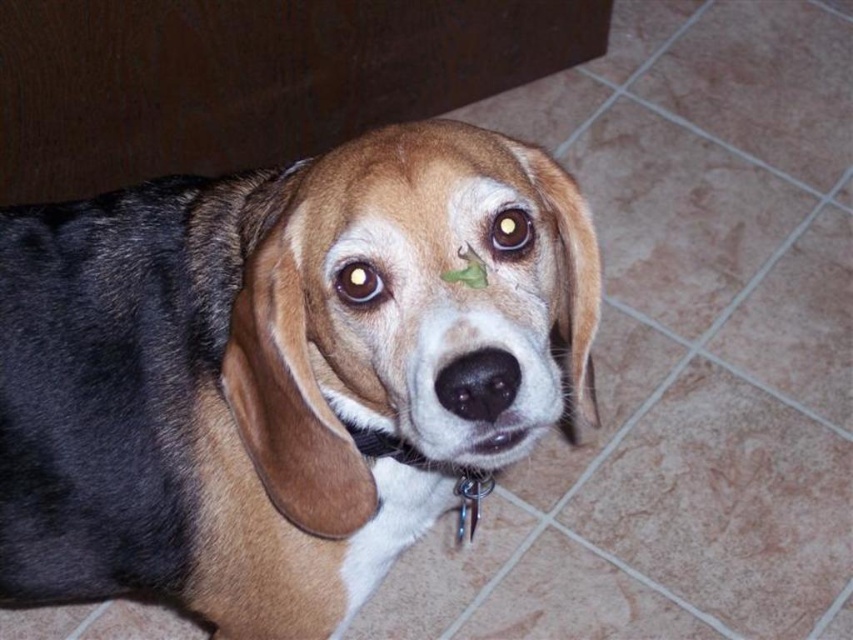
Can you confirm if brown fur eyebrow at upper center is positioned to the right of brown shiny eye at center?

Indeed, brown fur eyebrow at upper center is positioned on the right side of brown shiny eye at center.

Who is positioned more to the left, brown fur eyebrow at upper center or brown shiny eye at center?

brown shiny eye at center

The height and width of the screenshot is (640, 853). What are the coordinates of `brown fur eyebrow at upper center` in the screenshot? It's located at (364, 236).

Is brown fur dog at center taller than brown glossy eye at center?

Indeed, brown fur dog at center has a greater height compared to brown glossy eye at center.

Identify the location of brown fur dog at center. The width and height of the screenshot is (853, 640). (271, 372).

Is brown matte dog face at center above metallic chain at center?

Yes.

Between point (451, 340) and point (462, 504), which one is positioned behind?

Positioned behind is point (462, 504).

This screenshot has height=640, width=853. Find the location of `brown matte dog face at center`. brown matte dog face at center is located at coordinates (450, 317).